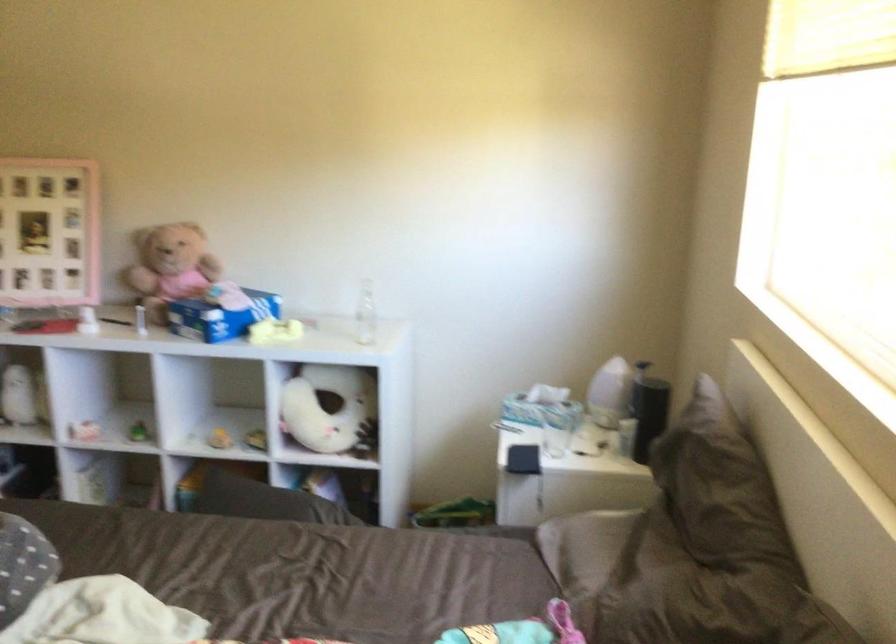
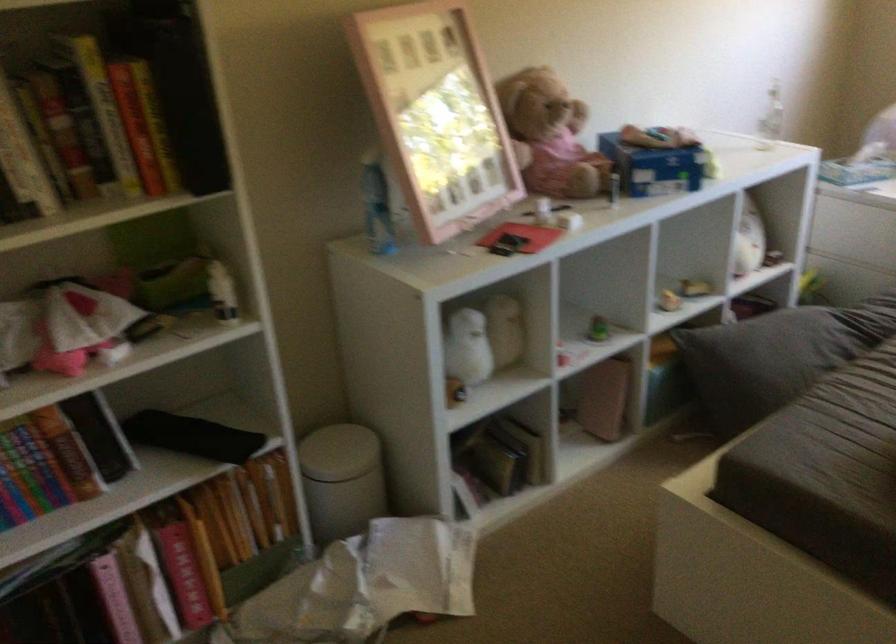
The point at (169,270) is marked in the first image. Where is the corresponding point in the second image?

(549, 136)